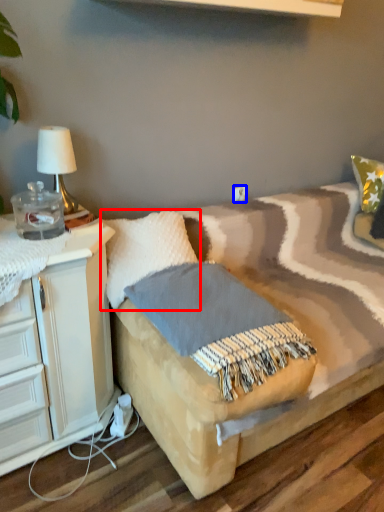
Question: Which object is further to the camera taking this photo, pillow (highlighted by a red box) or electric outlet (highlighted by a blue box)?

Choices:
 (A) pillow
 (B) electric outlet

Answer: (B)